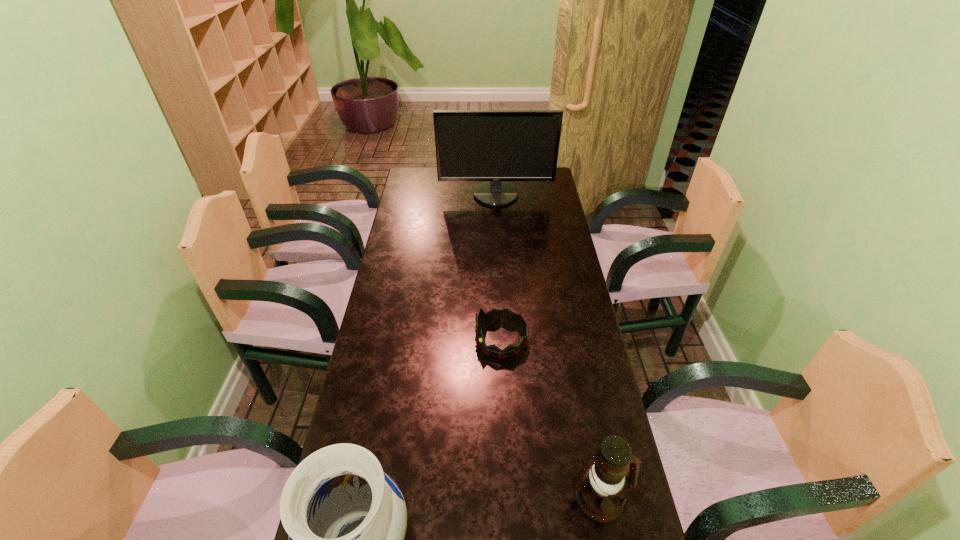
Image resolution: width=960 pixels, height=540 pixels. I want to click on the farthest object, so click(471, 145).

Locate an element on the screen. monitor is located at coordinates (471, 145).

Locate an element on the screen. lantern is located at coordinates (600, 485).

Where is `the second farthest object`? the second farthest object is located at coordinates (494, 315).

Locate an element on the screen. This screenshot has height=540, width=960. tiara is located at coordinates (494, 315).

Identify the location of free location located on the screen side of the monitor. Image resolution: width=960 pixels, height=540 pixels. tap(497, 221).

The height and width of the screenshot is (540, 960). I want to click on vacant point located 0.060m at the front of the shortest object with jewels, so click(455, 339).

I want to click on free space located at the front of the shortest object with jewels, so click(x=390, y=339).

Locate an element on the screen. The image size is (960, 540). vacant space located at the front of the shortest object with jewels is located at coordinates (390, 339).

The height and width of the screenshot is (540, 960). What are the coordinates of `object that is at the far edge` in the screenshot? It's located at (471, 145).